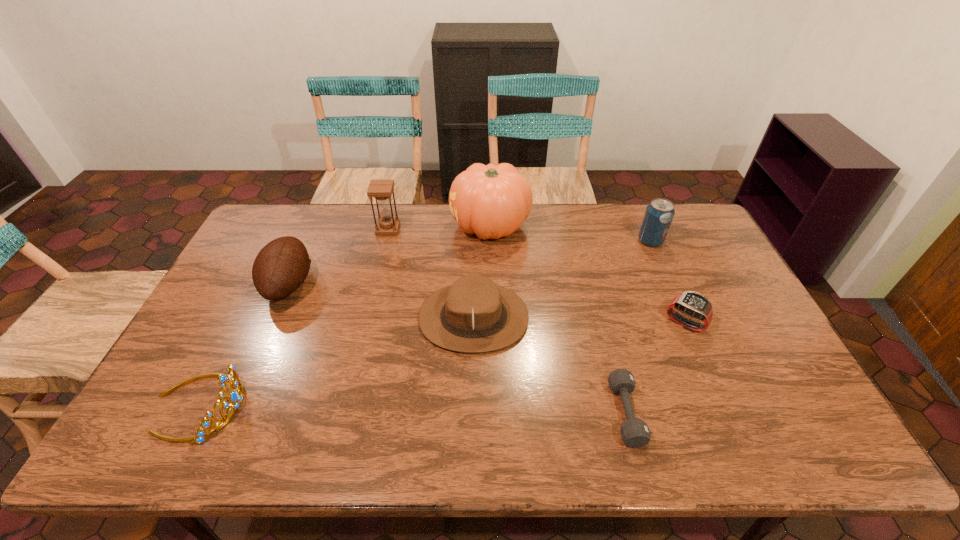
What are the coordinates of `free space at the left edge of the desktop` in the screenshot? It's located at coord(250,276).

Find the location of a particular element. The width and height of the screenshot is (960, 540). vacant area at the far left corner of the desktop is located at coordinates (296, 212).

The image size is (960, 540). In order to click on free location at the near left corner of the desktop in this screenshot , I will do `click(155, 432)`.

Locate an element on the screen. free point at the far right corner is located at coordinates (693, 235).

The height and width of the screenshot is (540, 960). I want to click on blank space at the near right corner of the desktop, so tap(786, 444).

Locate an element on the screen. The height and width of the screenshot is (540, 960). free point between the tallest object and the football is located at coordinates (390, 255).

Locate an element on the screen. The image size is (960, 540). free space between the shortest object and the third shortest object is located at coordinates (413, 409).

Locate an element on the screen. This screenshot has height=540, width=960. unoccupied position between the fedora and the tallest object is located at coordinates (482, 272).

You are a GUI agent. You are given a task and a screenshot of the screen. Output one action in this format:
    pyautogui.click(x=<x>, y=<y>)
    Task: Click on the empty space that is in between the fedora and the tallest object
    
    Given the screenshot: What is the action you would take?
    pyautogui.click(x=482, y=272)

I want to click on empty space between the tiara and the football, so click(x=245, y=345).